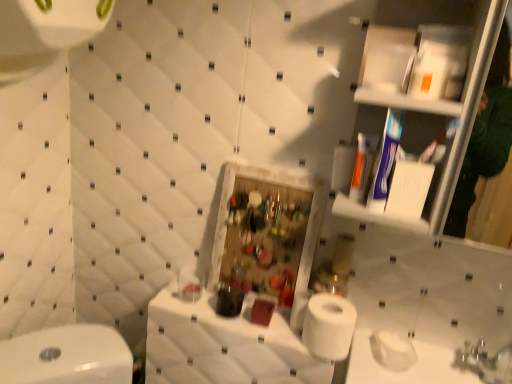
Question: Can we say white fabric counter at center lies outside white matte toilet paper at lower right?

Choices:
 (A) no
 (B) yes

Answer: (B)

Question: Can you confirm if white fabric counter at center is thinner than white matte toilet paper at lower right?

Choices:
 (A) no
 (B) yes

Answer: (A)

Question: Is white fabric counter at center not near white matte toilet paper at lower right?

Choices:
 (A) no
 (B) yes

Answer: (A)

Question: Does white fabric counter at center appear on the right side of white matte toilet paper at lower right?

Choices:
 (A) yes
 (B) no

Answer: (B)

Question: Does white fabric counter at center have a greater width compared to white matte toilet paper at lower right?

Choices:
 (A) yes
 (B) no

Answer: (A)

Question: Is white fabric counter at center positioned with its back to white matte toilet paper at lower right?

Choices:
 (A) yes
 (B) no

Answer: (B)

Question: Could you tell me if white matte toilet paper at lower right is facing white fabric counter at center?

Choices:
 (A) yes
 (B) no

Answer: (B)

Question: Does white matte toilet paper at lower right have a lesser width compared to white fabric counter at center?

Choices:
 (A) no
 (B) yes

Answer: (B)

Question: Is white matte toilet paper at lower right next to white fabric counter at center?

Choices:
 (A) yes
 (B) no

Answer: (B)

Question: Does white matte toilet paper at lower right have a greater width compared to white fabric counter at center?

Choices:
 (A) no
 (B) yes

Answer: (A)

Question: Can you confirm if white matte toilet paper at lower right is smaller than white fabric counter at center?

Choices:
 (A) yes
 (B) no

Answer: (A)

Question: Would you say white matte toilet paper at lower right is a long distance from white fabric counter at center?

Choices:
 (A) no
 (B) yes

Answer: (A)

Question: From the image's perspective, is white fabric counter at center located above or below white matte toilet paper at lower right?

Choices:
 (A) below
 (B) above

Answer: (A)